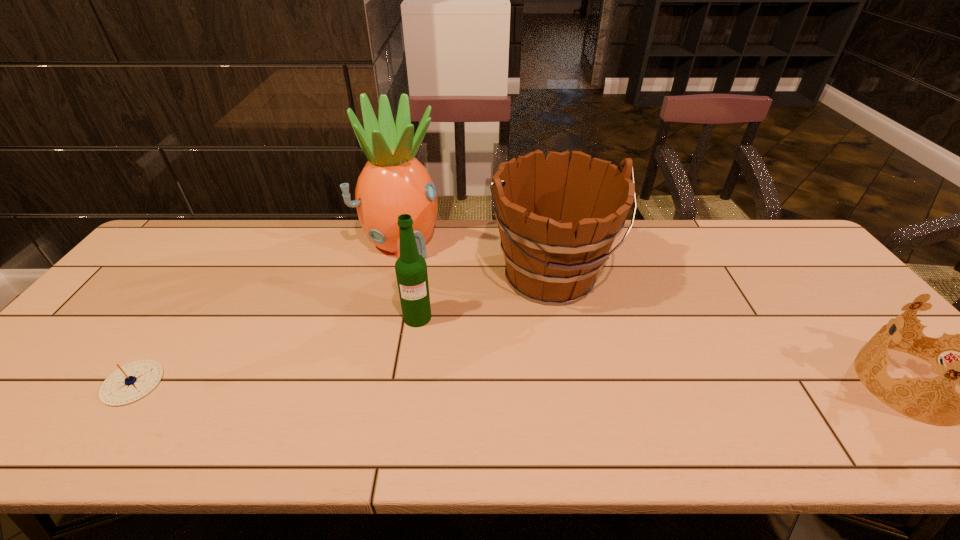
Image resolution: width=960 pixels, height=540 pixels. Find the location of `compass`. compass is located at coordinates (131, 382).

You are a GUI agent. You are given a task and a screenshot of the screen. Output one action in this format:
    pyautogui.click(x=<x>, y=<y>)
    Task: Click on the shortest object
    This screenshot has height=540, width=960.
    Given the screenshot: What is the action you would take?
    pyautogui.click(x=131, y=382)

In order to click on pineapple in this screenshot , I will do `click(393, 182)`.

Find the location of `wine bucket`. wine bucket is located at coordinates 552,258.

Where is `beer bottle`? beer bottle is located at coordinates (411, 269).

Image resolution: width=960 pixels, height=540 pixels. In order to click on vacant space located 0.160m on the back of the compass in this screenshot , I will do `click(181, 314)`.

This screenshot has width=960, height=540. What are the coordinates of `blank area located 0.360m at the entrance of the tallest object` in the screenshot? It's located at (479, 339).

This screenshot has width=960, height=540. Find the location of `blank space located 0.340m at the entrance of the tallest object`. blank space located 0.340m at the entrance of the tallest object is located at coordinates (474, 334).

You are a GUI agent. You are given a task and a screenshot of the screen. Output one action in this format:
    pyautogui.click(x=<x>, y=<y>)
    Task: Click on the blank space located 0.160m at the entrance of the tallest object
    Image resolution: width=960 pixels, height=540 pixels.
    Given the screenshot: What is the action you would take?
    pyautogui.click(x=443, y=293)

I want to click on vacant space located 0.210m with the handle on the wine bucket, so click(x=613, y=383).